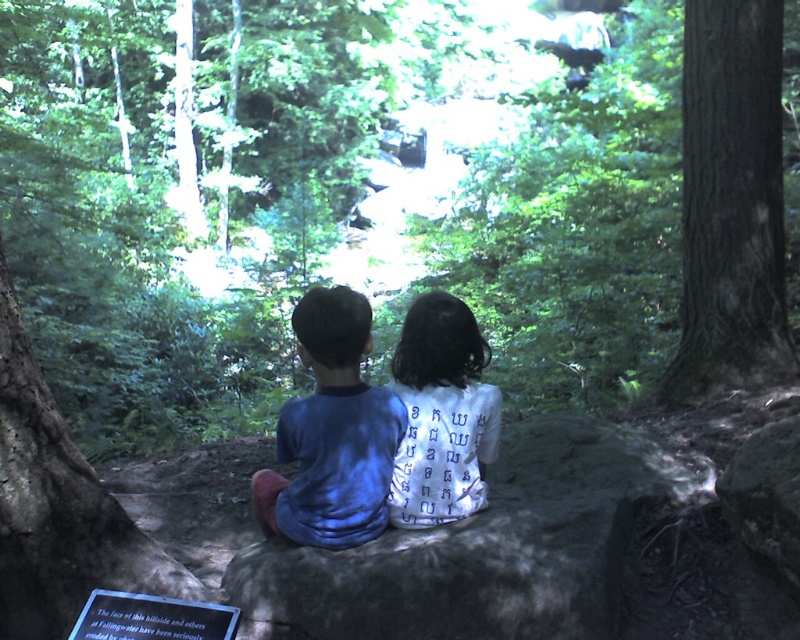
From the picture: You are a hiker who wants to place a small backpack between the smooth brown bark at right and the blue cotton shirt at center. The backpack requires at least 10 feet of space to fit. Based on the scene, will there be enough space?

The distance between the smooth brown bark at right and the blue cotton shirt at center is 8.15 feet, which is less than the required 10 feet. Therefore, there isn not enough space to place the backpack between them.

You are planning to place a small toy between the smooth brown bark at right and the white fabric shirt at center. Given their sizes, which object should you place the toy closer to to ensure it fits within the available space?

The smooth brown bark at right has a larger width than the white fabric shirt at center. To ensure the toy fits within the available space, place it closer to the white fabric shirt at center since it occupies less space.

You are a hiker trying to cross a narrow path between the gray textured rock at center and the smooth brown bark at right. The path is only 1 meter wide. Can you fit through if you need 0.8 meters of space?

The gray textured rock at center is wider than the smooth brown bark at right. Since the path between them is 1 meter wide and you require 0.8 meters, you can fit through the path between the gray textured rock at center and the smooth brown bark at right.